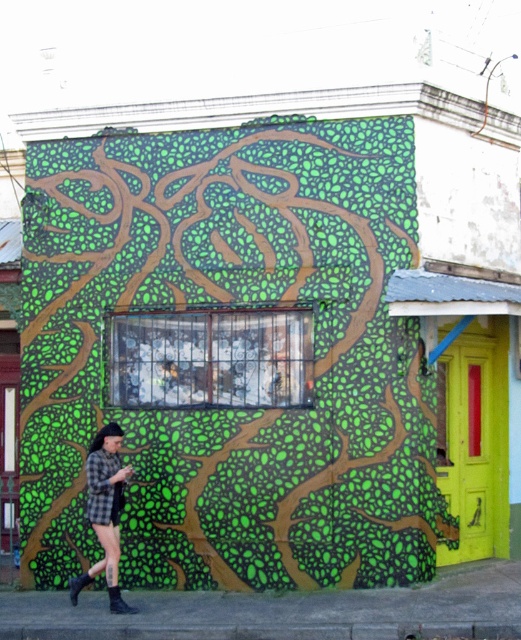
Question: Observing the image, what is the correct spatial positioning of green textured wall at center in reference to checkered fabric shorts at lower left?

Choices:
 (A) right
 (B) left

Answer: (A)

Question: Which point is farther from the camera taking this photo?

Choices:
 (A) (208, 474)
 (B) (117, 499)

Answer: (A)

Question: Is green textured wall at center above checkered fabric shorts at lower left?

Choices:
 (A) yes
 (B) no

Answer: (A)

Question: Which of the following is the farthest from the observer?

Choices:
 (A) (127, 433)
 (B) (75, 577)

Answer: (B)

Question: Which point is closer to the camera?

Choices:
 (A) checkered fabric shorts at lower left
 (B) green textured wall at center

Answer: (A)

Question: Is green textured wall at center to the left of checkered fabric shorts at lower left from the viewer's perspective?

Choices:
 (A) no
 (B) yes

Answer: (A)